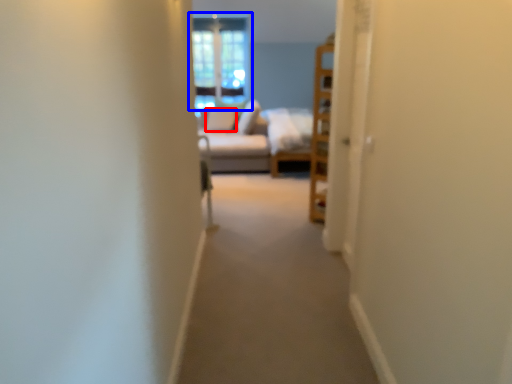
Question: Which object is closer to the camera taking this photo, pillow (highlighted by a red box) or window (highlighted by a blue box)?

Choices:
 (A) pillow
 (B) window

Answer: (A)